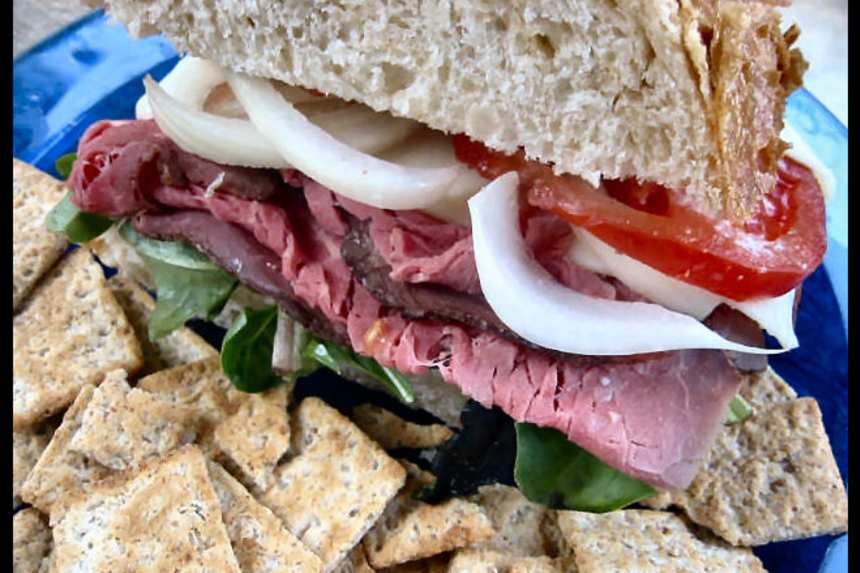
This screenshot has height=573, width=860. I want to click on table, so click(x=821, y=30), click(x=34, y=30).